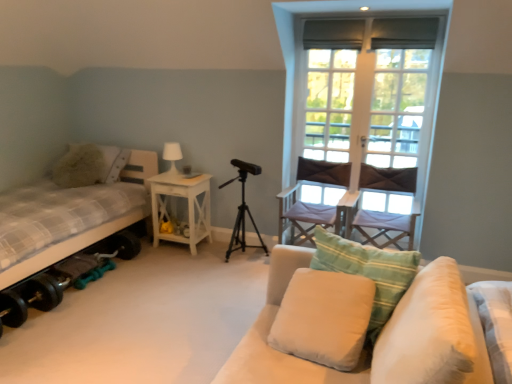
I want to click on free location in front of white wood nightstand at center, so click(x=175, y=268).